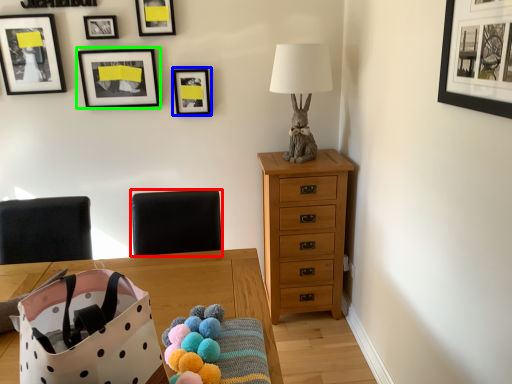
Question: Which is farther away from armchair (highlighted by a red box)? picture frame (highlighted by a blue box) or picture frame (highlighted by a green box)?

Choices:
 (A) picture frame
 (B) picture frame

Answer: (B)